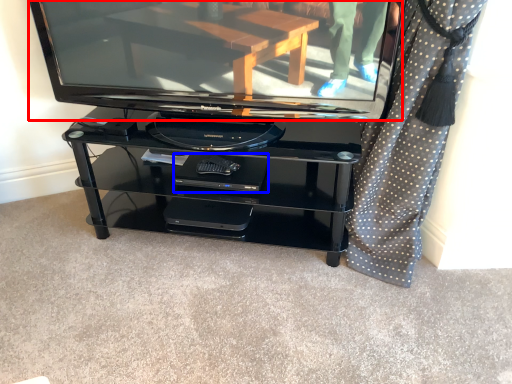
Question: Which of the following is the farthest to the observer, television (highlighted by a red box) or footrest (highlighted by a blue box)?

Choices:
 (A) television
 (B) footrest

Answer: (B)